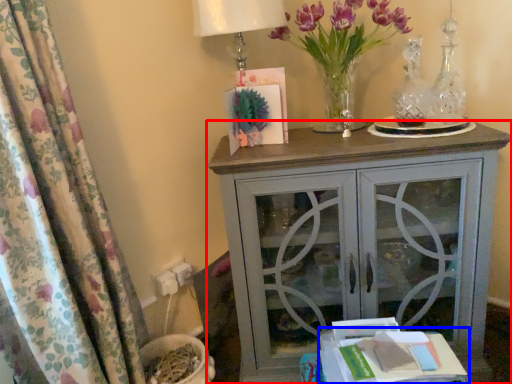
Question: Which object appears farthest to the camera in this image, nightstand (highlighted by a red box) or table (highlighted by a blue box)?

Choices:
 (A) nightstand
 (B) table

Answer: (A)